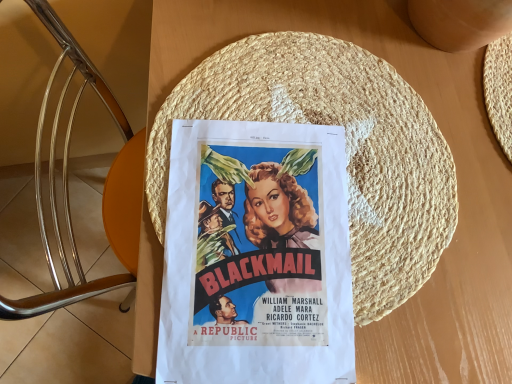
Question: From a real-world perspective, is matte paper poster at center located beneath woven straw hat at center?

Choices:
 (A) no
 (B) yes

Answer: (B)

Question: Can you confirm if matte paper poster at center is wider than woven straw hat at center?

Choices:
 (A) yes
 (B) no

Answer: (B)

Question: From the image's perspective, does matte paper poster at center appear lower than woven straw hat at center?

Choices:
 (A) no
 (B) yes

Answer: (B)

Question: From a real-world perspective, is matte paper poster at center on woven straw hat at center?

Choices:
 (A) no
 (B) yes

Answer: (A)

Question: Is matte paper poster at center placed right next to woven straw hat at center?

Choices:
 (A) yes
 (B) no

Answer: (A)

Question: Would you say woven straw hat at center is part of matte paper poster at center's contents?

Choices:
 (A) yes
 (B) no

Answer: (A)

Question: Can you confirm if woven straw hat at center is thinner than matte paper poster at center?

Choices:
 (A) yes
 (B) no

Answer: (B)

Question: From a real-world perspective, is woven straw hat at center physically below matte paper poster at center?

Choices:
 (A) no
 (B) yes

Answer: (A)

Question: Is woven straw hat at center to the right of matte paper poster at center from the viewer's perspective?

Choices:
 (A) no
 (B) yes

Answer: (B)

Question: Can you confirm if woven straw hat at center is positioned to the left of matte paper poster at center?

Choices:
 (A) yes
 (B) no

Answer: (B)

Question: Is woven straw hat at center far from matte paper poster at center?

Choices:
 (A) no
 (B) yes

Answer: (A)

Question: Can you confirm if woven straw hat at center is wider than matte paper poster at center?

Choices:
 (A) yes
 (B) no

Answer: (A)

Question: Would you say matte paper poster at center is to the left or to the right of woven straw hat at center in the picture?

Choices:
 (A) right
 (B) left

Answer: (B)